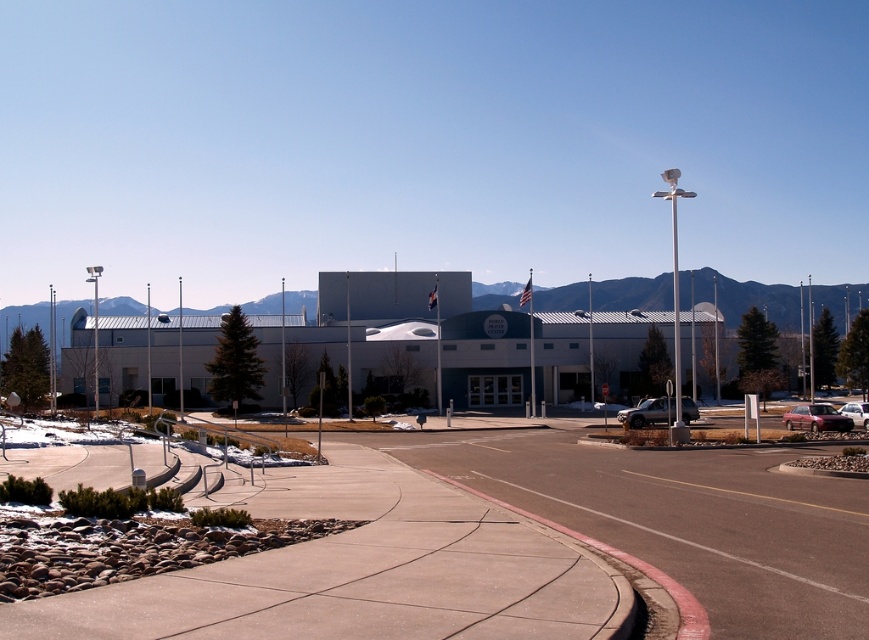
Does concrete at center have a larger size compared to satin silver sedan at lower right?

Yes, concrete at center is bigger than satin silver sedan at lower right.

Does concrete at center have a smaller size compared to satin silver sedan at lower right?

Actually, concrete at center might be larger than satin silver sedan at lower right.

Find the location of a particular element. Image resolution: width=869 pixels, height=640 pixels. concrete at center is located at coordinates (360, 572).

Does satin burgundy sedan at lower right lie in front of satin silver sedan at lower right?

Yes, satin burgundy sedan at lower right is closer to the viewer.

The image size is (869, 640). Describe the element at coordinates (816, 419) in the screenshot. I see `satin burgundy sedan at lower right` at that location.

Locate an element on the screen. The width and height of the screenshot is (869, 640). satin burgundy sedan at lower right is located at coordinates tap(816, 419).

Who is shorter, satin silver sedan at lower right or white glossy sedan at right?

satin silver sedan at lower right is shorter.

Between point (642, 412) and point (851, 404), which one is positioned behind?

Point (642, 412)

Is point (647, 400) in front of point (847, 403)?

Yes, point (647, 400) is in front of point (847, 403).

Where is `satin silver sedan at lower right`? satin silver sedan at lower right is located at coordinates (644, 412).